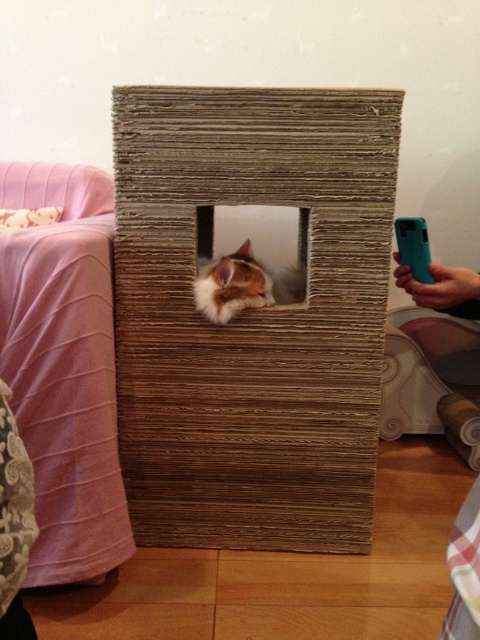
Is teal plastic phone at lower right to the left of fluffy orange cat at center from the viewer's perspective?

Incorrect, teal plastic phone at lower right is not on the left side of fluffy orange cat at center.

Is teal plastic phone at lower right closer to camera compared to fluffy orange cat at center?

Yes, teal plastic phone at lower right is in front of fluffy orange cat at center.

What do you see at coordinates (465, 572) in the screenshot? The height and width of the screenshot is (640, 480). I see `teal plastic phone at lower right` at bounding box center [465, 572].

Locate an element on the screen. This screenshot has width=480, height=640. teal plastic phone at lower right is located at coordinates (465, 572).

Between brown cardboard box at center and fluffy orange cat at center, which one appears on the left side from the viewer's perspective?

fluffy orange cat at center is more to the left.

What do you see at coordinates (252, 316) in the screenshot? This screenshot has width=480, height=640. I see `brown cardboard box at center` at bounding box center [252, 316].

Describe the element at coordinates (252, 316) in the screenshot. This screenshot has height=640, width=480. I see `brown cardboard box at center` at that location.

Where is `brown cardboard box at center`? brown cardboard box at center is located at coordinates (252, 316).

This screenshot has width=480, height=640. What do you see at coordinates (252, 316) in the screenshot? I see `brown cardboard box at center` at bounding box center [252, 316].

Find the location of a particular element. The image size is (480, 640). brown cardboard box at center is located at coordinates (252, 316).